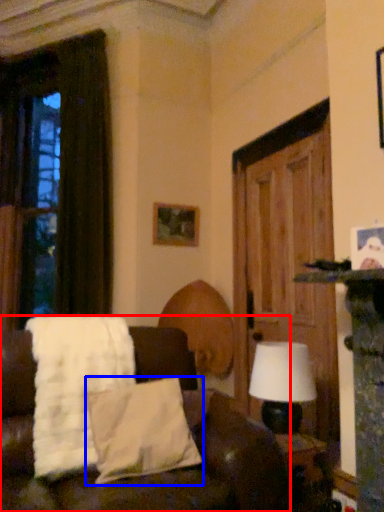
Question: Among these objects, which one is nearest to the camera, studio couch (highlighted by a red box) or pillow (highlighted by a blue box)?

Choices:
 (A) studio couch
 (B) pillow

Answer: (A)